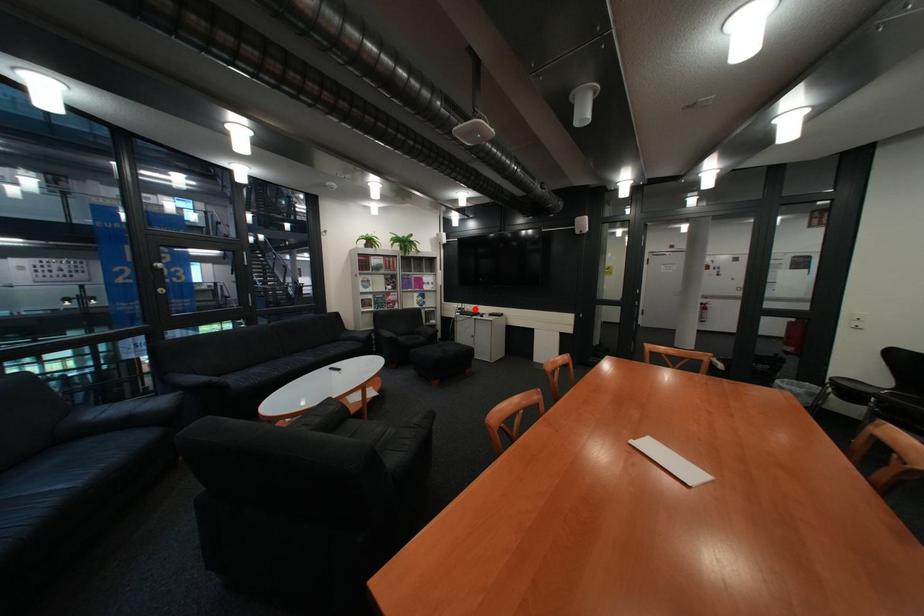
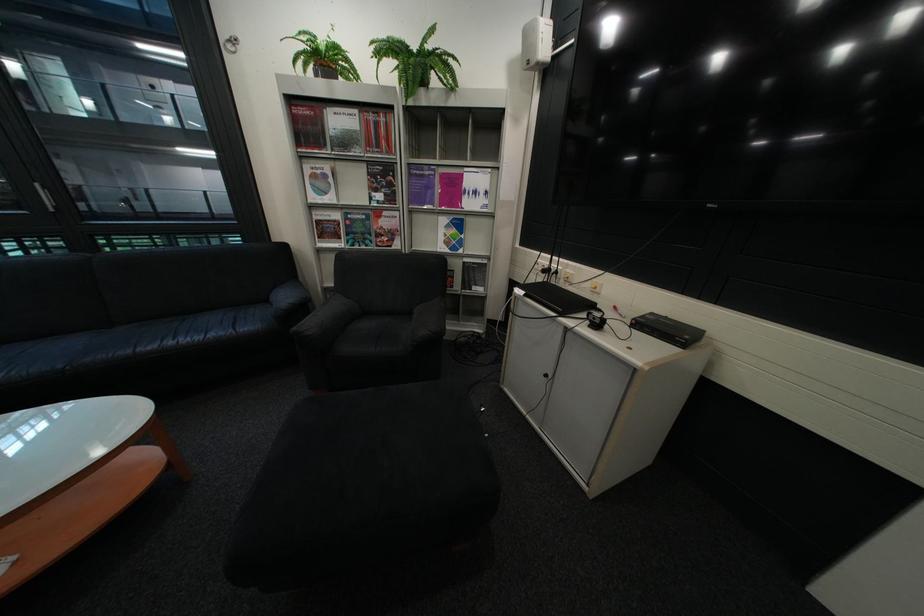
In the second image, find the point that corresponds to the highlighted location in the first image.

(563, 270)